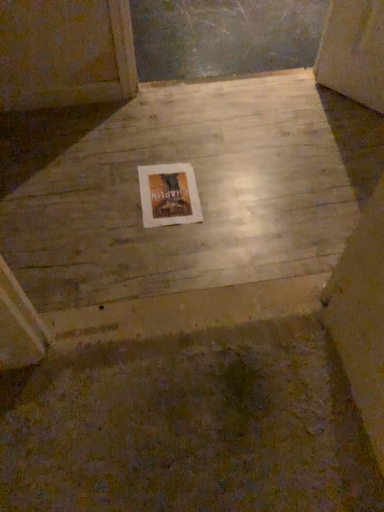
At what (x,y) coordinates should I click in order to perform the action: click on vacant area on top of white paper at center (from a real-world perspective). Please return your answer as a coordinate pair (x, y). This screenshot has width=384, height=512. Looking at the image, I should click on (168, 192).